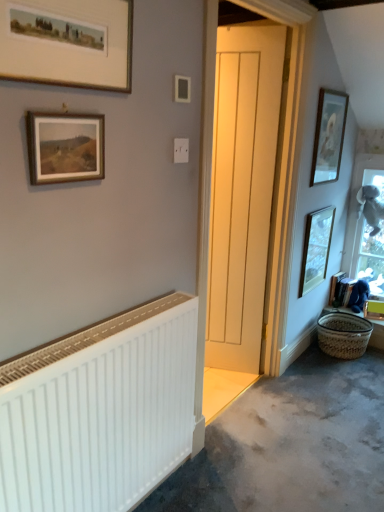
Question: Based on their positions, is white wooden door at center located to the left or right of wooden-framed painting at upper left, the 3th picture frame positioned from the back?

Choices:
 (A) left
 (B) right

Answer: (B)

Question: In the image, is white wooden door at center positioned in front of or behind wooden-framed painting at upper left, which is the fourth picture frame in right-to-left order?

Choices:
 (A) behind
 (B) front

Answer: (A)

Question: Which is farther from the wooden picture frame at lower right, which appears as the second picture frame when viewed from the right?

Choices:
 (A) matte wooden picture frame at upper right, the 4th picture frame in the left-to-right sequence
 (B) white matte radiator at lower left
 (C) gray carpet at lower right
 (D) gold-framed print at upper left, which appears as the fourth picture frame when viewed from the back
 (E) white wooden door at center

Answer: (D)

Question: Which object is the closest to the wooden-framed painting at upper left, the 3th picture frame positioned from the back?

Choices:
 (A) white wooden door at center
 (B) gray carpet at lower right
 (C) white matte radiator at lower left
 (D) woven straw basket at lower right
 (E) matte wooden picture frame at upper right, which ranks as the 2th picture frame in back-to-front order

Answer: (C)